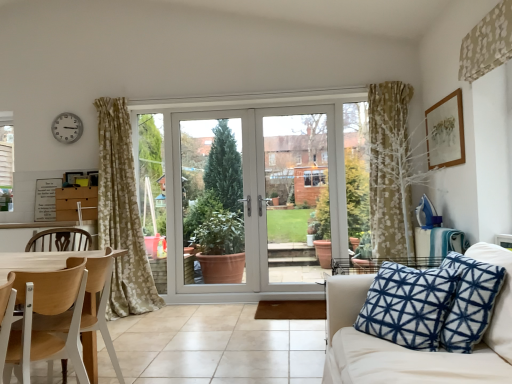
Locate an element on the screen. This screenshot has width=512, height=384. free location above clear glass door at center, arranged as the 2th screen door when viewed from the right (from a real-world perspective) is located at coordinates (208, 110).